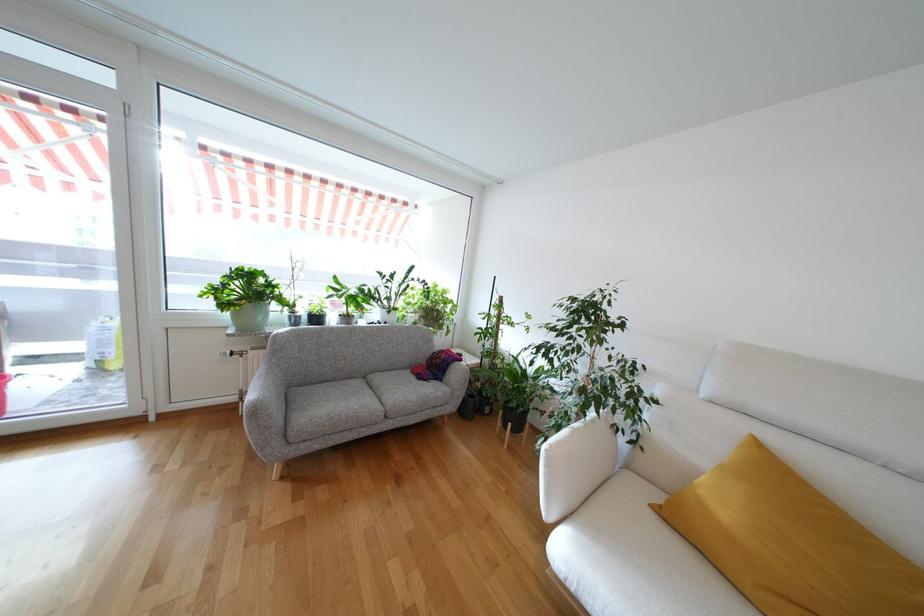
The height and width of the screenshot is (616, 924). Describe the element at coordinates (570, 477) in the screenshot. I see `a white sofa armrest` at that location.